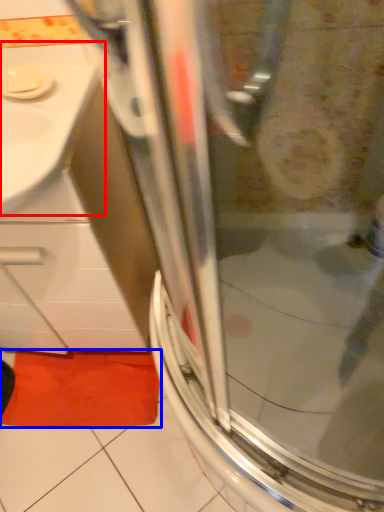
Question: Which point is further to the camera, sink (highlighted by a red box) or bath mat (highlighted by a blue box)?

Choices:
 (A) sink
 (B) bath mat

Answer: (B)